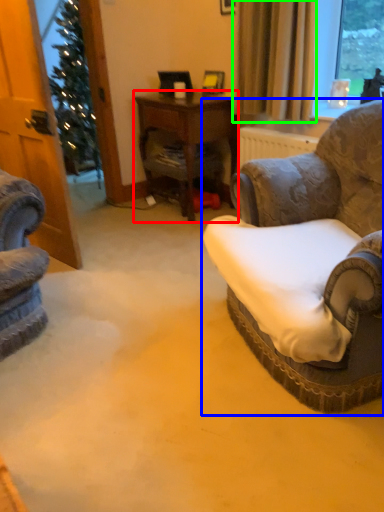
Question: Based on their relative distances, which object is farther from desk (highlighted by a red box)? Choose from chair (highlighted by a blue box) and curtain (highlighted by a green box).

Choices:
 (A) chair
 (B) curtain

Answer: (A)